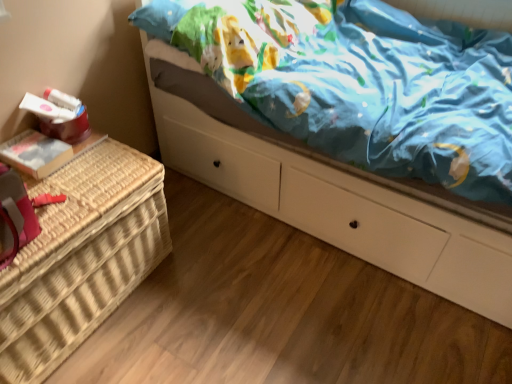
Question: Is white glossy bed at upper center far away from woven wicker basket at left?

Choices:
 (A) no
 (B) yes

Answer: (A)

Question: Is white glossy bed at upper center to the left of woven wicker basket at left from the viewer's perspective?

Choices:
 (A) yes
 (B) no

Answer: (B)

Question: Is white glossy bed at upper center aimed at woven wicker basket at left?

Choices:
 (A) yes
 (B) no

Answer: (A)

Question: Does white glossy bed at upper center have a greater width compared to woven wicker basket at left?

Choices:
 (A) yes
 (B) no

Answer: (A)

Question: From the image's perspective, is white glossy bed at upper center on woven wicker basket at left?

Choices:
 (A) yes
 (B) no

Answer: (A)

Question: Does white glossy bed at upper center have a smaller size compared to woven wicker basket at left?

Choices:
 (A) no
 (B) yes

Answer: (A)

Question: Is woven wicker basket at left placed right next to white glossy bed at upper center?

Choices:
 (A) yes
 (B) no

Answer: (B)

Question: From the image's perspective, is woven wicker basket at left located beneath white glossy bed at upper center?

Choices:
 (A) yes
 (B) no

Answer: (A)

Question: Does woven wicker basket at left come in front of white glossy bed at upper center?

Choices:
 (A) yes
 (B) no

Answer: (B)

Question: Is woven wicker basket at left aimed at white glossy bed at upper center?

Choices:
 (A) yes
 (B) no

Answer: (B)

Question: Does woven wicker basket at left lie behind white glossy bed at upper center?

Choices:
 (A) no
 (B) yes

Answer: (B)

Question: From a real-world perspective, is woven wicker basket at left located higher than white glossy bed at upper center?

Choices:
 (A) no
 (B) yes

Answer: (A)

Question: From a real-world perspective, relative to white glossy bed at upper center, is woven wicker basket at left vertically above or below?

Choices:
 (A) above
 (B) below

Answer: (B)